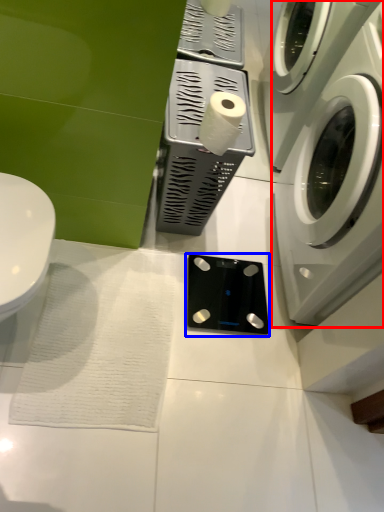
Question: Among these objects, which one is farthest to the camera, washing machine (highlighted by a red box) or appliance (highlighted by a blue box)?

Choices:
 (A) washing machine
 (B) appliance

Answer: (B)